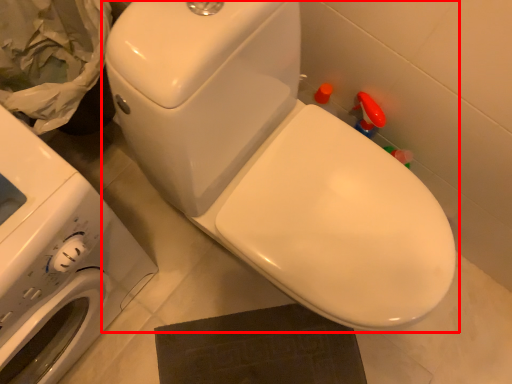
Question: In this image, where is toilet (annotated by the red box) located relative to washing machine?

Choices:
 (A) right
 (B) left

Answer: (A)